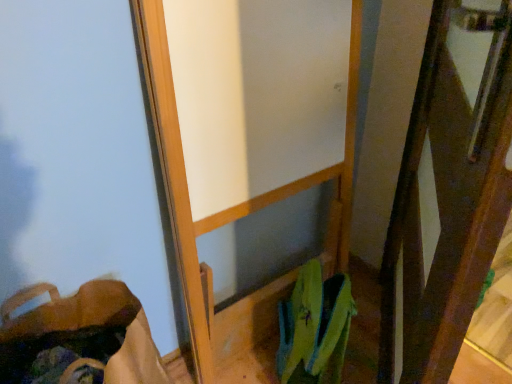
The image size is (512, 384). What do you see at coordinates (92, 325) in the screenshot?
I see `brown fabric shoulder bag at lower left` at bounding box center [92, 325].

What are the coordinates of `brown fabric shoulder bag at lower left` in the screenshot? It's located at (92, 325).

Describe the element at coordinates (448, 197) in the screenshot. I see `brown wooden screen door at right` at that location.

You are a GUI agent. You are given a task and a screenshot of the screen. Output one action in this format:
    pyautogui.click(x=<x>, y=<y>)
    Task: Click on the brown wooden screen door at right
    
    Given the screenshot: What is the action you would take?
    pyautogui.click(x=448, y=197)

The image size is (512, 384). I want to click on brown fabric shoulder bag at lower left, so click(92, 325).

Consider the image. Does brown wooden screen door at right appear on the right side of brown fabric shoulder bag at lower left?

Yes, brown wooden screen door at right is to the right of brown fabric shoulder bag at lower left.

Which object is more forward, brown wooden screen door at right or brown fabric shoulder bag at lower left?

brown wooden screen door at right is in front.

Is point (463, 146) behind point (28, 335)?

No, it is in front of (28, 335).

From the image's perspective, would you say brown wooden screen door at right is shown under brown fabric shoulder bag at lower left?

No, from the image's perspective, brown wooden screen door at right is not below brown fabric shoulder bag at lower left.

From a real-world perspective, who is located higher, brown wooden screen door at right or brown fabric shoulder bag at lower left?

From a 3D spatial view, brown wooden screen door at right is above.

Is brown wooden screen door at right wider than brown fabric shoulder bag at lower left?

No.

Considering the sizes of objects brown wooden screen door at right and brown fabric shoulder bag at lower left in the image provided, who is shorter, brown wooden screen door at right or brown fabric shoulder bag at lower left?

brown fabric shoulder bag at lower left is shorter.

Considering the sizes of brown wooden screen door at right and brown fabric shoulder bag at lower left in the image, is brown wooden screen door at right bigger or smaller than brown fabric shoulder bag at lower left?

In the image, brown wooden screen door at right appears to be larger than brown fabric shoulder bag at lower left.

Is brown wooden screen door at right located outside brown fabric shoulder bag at lower left?

Yes, brown wooden screen door at right is outside of brown fabric shoulder bag at lower left.

Based on the photo, are brown wooden screen door at right and brown fabric shoulder bag at lower left far apart?

brown wooden screen door at right is actually quite close to brown fabric shoulder bag at lower left.

Is brown fabric shoulder bag at lower left at the back of brown wooden screen door at right?

That's right, brown wooden screen door at right is facing away from brown fabric shoulder bag at lower left.

How many degrees apart are the facing directions of brown wooden screen door at right and brown fabric shoulder bag at lower left?

brown wooden screen door at right and brown fabric shoulder bag at lower left are facing 33.7 degrees away from each other.

How distant is brown wooden screen door at right from brown fabric shoulder bag at lower left?

They are 71.06 centimeters apart.

Image resolution: width=512 pixels, height=384 pixels. There is a brown fabric shoulder bag at lower left. Identify the location of screen door above it (from a real-world perspective). (448, 197).

Is brown fabric shoulder bag at lower left to the left or to the right of brown wooden screen door at right in the image?

In the image, brown fabric shoulder bag at lower left appears on the left side of brown wooden screen door at right.

Is brown fabric shoulder bag at lower left positioned before brown wooden screen door at right?

That is False.

Which point is more forward, (82, 311) or (452, 134)?

The point (452, 134) is more forward.

From the image's perspective, which is above, brown fabric shoulder bag at lower left or brown wooden screen door at right?

brown wooden screen door at right is shown above in the image.

From a real-world perspective, is brown fabric shoulder bag at lower left positioned over brown wooden screen door at right based on gravity?

No.

Does brown fabric shoulder bag at lower left have a greater width compared to brown wooden screen door at right?

Correct, the width of brown fabric shoulder bag at lower left exceeds that of brown wooden screen door at right.

In terms of height, does brown fabric shoulder bag at lower left look taller or shorter compared to brown wooden screen door at right?

Considering their sizes, brown fabric shoulder bag at lower left has less height than brown wooden screen door at right.

Does brown fabric shoulder bag at lower left have a larger size compared to brown wooden screen door at right?

No.

Is brown fabric shoulder bag at lower left inside the boundaries of brown wooden screen door at right, or outside?

brown fabric shoulder bag at lower left is located beyond the bounds of brown wooden screen door at right.

Does brown fabric shoulder bag at lower left touch brown wooden screen door at right?

No.

Is brown fabric shoulder bag at lower left turned away from brown wooden screen door at right?

No, brown fabric shoulder bag at lower left's orientation is not away from brown wooden screen door at right.

The image size is (512, 384). What are the coordinates of `screen door above the brown fabric shoulder bag at lower left (from a real-world perspective)` in the screenshot? It's located at (448, 197).

Where is `shoulder bag below the brown wooden screen door at right (from a real-world perspective)`? Image resolution: width=512 pixels, height=384 pixels. shoulder bag below the brown wooden screen door at right (from a real-world perspective) is located at coordinates (92, 325).

Where is `screen door above the brown fabric shoulder bag at lower left (from the image's perspective)`? Image resolution: width=512 pixels, height=384 pixels. screen door above the brown fabric shoulder bag at lower left (from the image's perspective) is located at coordinates (448, 197).